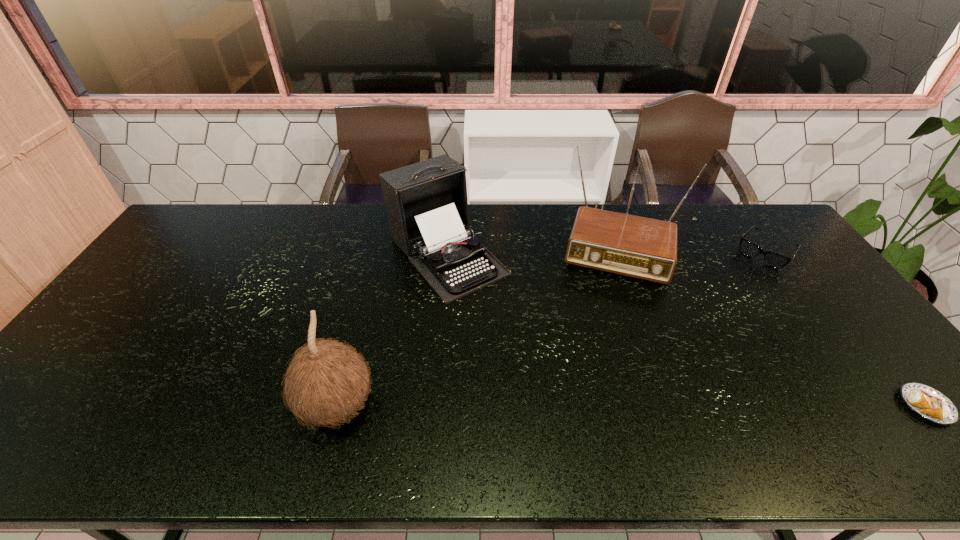
The image size is (960, 540). I want to click on free location located 0.360m on the front-facing side of the fourth tallest object, so click(x=704, y=326).

Identify the location of vacant space located 0.090m on the front panel of the radio_receiver. The width and height of the screenshot is (960, 540). (607, 305).

Locate an element on the screen. The image size is (960, 540). vacant space located 0.380m on the front panel of the radio_receiver is located at coordinates (593, 386).

Locate an element on the screen. The image size is (960, 540). free space located on the front panel of the radio_receiver is located at coordinates pos(597,361).

Where is `typewriter at the far edge`? Image resolution: width=960 pixels, height=540 pixels. typewriter at the far edge is located at coordinates (426, 202).

Locate an element on the screen. Image resolution: width=960 pixels, height=540 pixels. sunglasses located at the far edge is located at coordinates (772, 259).

Locate an element on the screen. radio_receiver located at the far edge is located at coordinates (639, 247).

You are a GUI agent. You are given a task and a screenshot of the screen. Output one action in this format:
    pyautogui.click(x=<x>, y=<y>)
    Task: Click on the object that is at the near edge
    The width and height of the screenshot is (960, 540).
    Given the screenshot: What is the action you would take?
    pyautogui.click(x=327, y=381)

I want to click on object present at the right edge, so click(772, 259).

The image size is (960, 540). In order to click on object that is at the far right corner in this screenshot , I will do [772, 259].